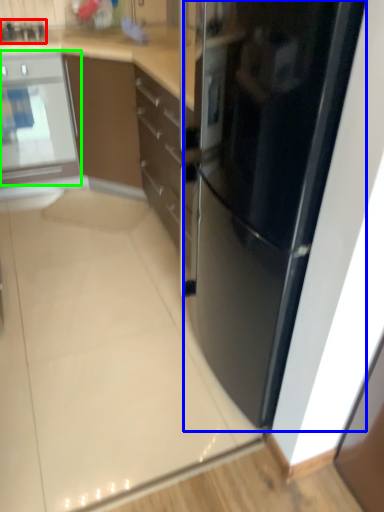
Question: Which is farther away from appliance (highlighted by a red box)? refrigerator (highlighted by a blue box) or home appliance (highlighted by a green box)?

Choices:
 (A) refrigerator
 (B) home appliance

Answer: (A)